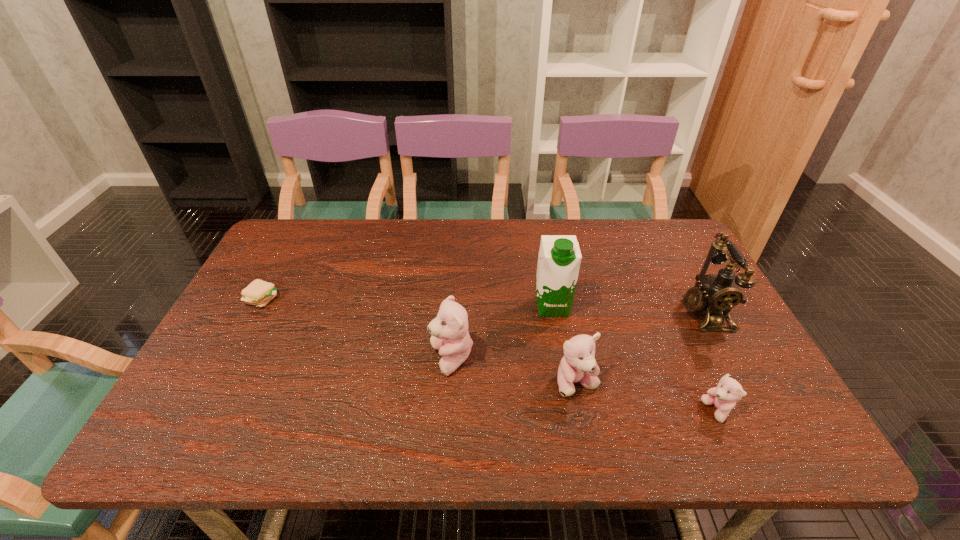
This screenshot has height=540, width=960. In order to click on vacant position located at the face of the fifth object from right to left in this screenshot , I will do `click(360, 359)`.

Where is `vacant space located 0.250m at the face of the fifth object from right to left`? Image resolution: width=960 pixels, height=540 pixels. vacant space located 0.250m at the face of the fifth object from right to left is located at coordinates (326, 359).

Locate an element on the screen. The image size is (960, 540). blank space located 0.050m at the face of the rightmost teddy bear is located at coordinates (681, 411).

Find the location of a particular element. Image resolution: width=960 pixels, height=540 pixels. vacant position located 0.300m at the face of the rightmost teddy bear is located at coordinates (566, 411).

Locate an element on the screen. This screenshot has height=540, width=960. vacant space located at the face of the rightmost teddy bear is located at coordinates (593, 411).

The image size is (960, 540). In order to click on free location located on the front-facing side of the soya milk in this screenshot , I will do `click(565, 380)`.

This screenshot has width=960, height=540. Identify the location of vacant space located on the rotary dial of the telephone. (603, 313).

At what (x,y) coordinates should I click in order to perform the action: click on vacant region located 0.050m on the rotary dial of the telephone. Please return your answer as a coordinate pair (x, y). The width and height of the screenshot is (960, 540). Looking at the image, I should click on (662, 313).

Identify the location of free space located 0.390m on the rotary dial of the telephone. This screenshot has width=960, height=540. (536, 313).

The image size is (960, 540). I want to click on free point located 0.120m on the back of the leftmost object, so click(x=283, y=261).